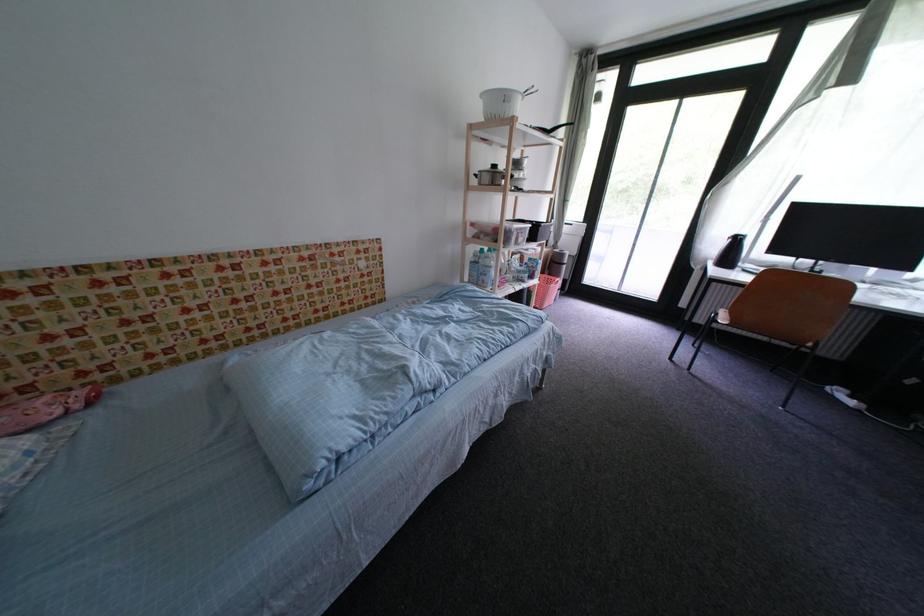
This screenshot has width=924, height=616. Identify the location of black pot handle. (493, 163).